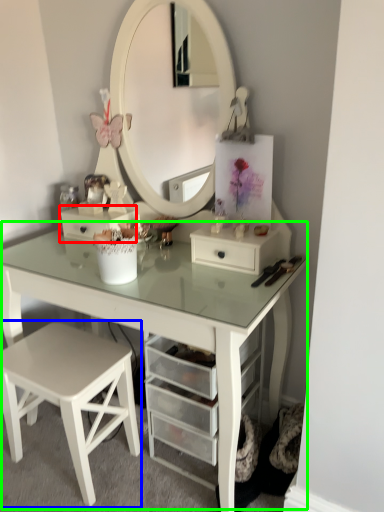
Question: Which object is positioned farthest from drawer (highlighted by a red box)? Select from stool (highlighted by a blue box) and table (highlighted by a green box).

Choices:
 (A) stool
 (B) table

Answer: (A)